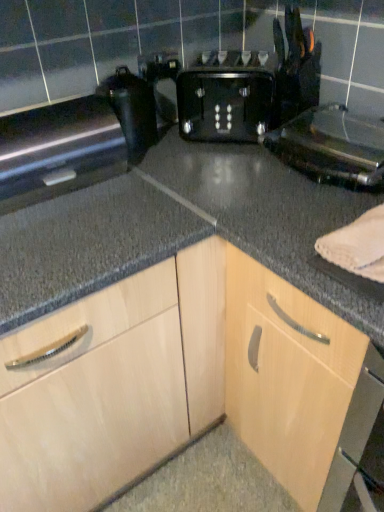
Identify the location of vacant space that's between black plastic toaster at center and black glossy coffee maker at upper left, which appears as the 2th appliance when viewed from the left. The height and width of the screenshot is (512, 384). (177, 146).